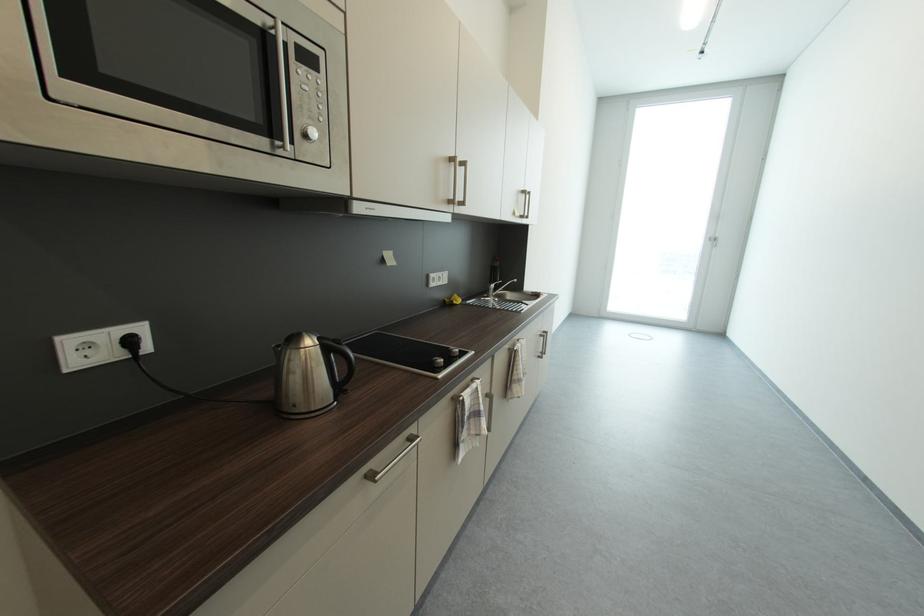
Where is `white door handle`? The width and height of the screenshot is (924, 616). white door handle is located at coordinates (392, 460).